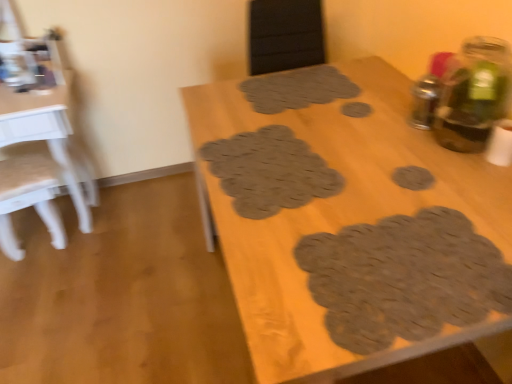
The width and height of the screenshot is (512, 384). I want to click on free space in front of brown textured mat at center, which is the first footprint in top-to-bottom order, so click(351, 131).